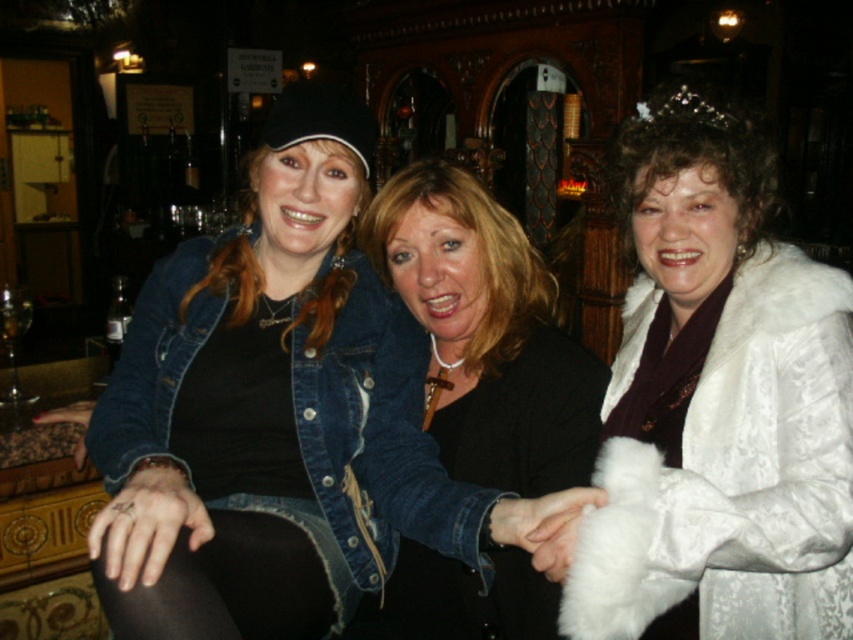
Question: Is denim jacket at center positioned in front of black matte jacket at center?

Choices:
 (A) no
 (B) yes

Answer: (B)

Question: Among these objects, which one is nearest to the camera?

Choices:
 (A) denim jacket at center
 (B) black tights at lower left
 (C) black matte jacket at center
 (D) white fur coat at center

Answer: (B)

Question: Which point is closer to the camera taking this photo?

Choices:
 (A) coord(132,561)
 (B) coord(825,602)

Answer: (A)

Question: Can you confirm if white fur coat at center is thinner than black tights at lower left?

Choices:
 (A) no
 (B) yes

Answer: (A)

Question: Is white fur coat at center wider than black matte jacket at center?

Choices:
 (A) no
 (B) yes

Answer: (B)

Question: Among these points, which one is nearest to the camera?

Choices:
 (A) (265, 605)
 (B) (379, 362)
 (C) (415, 202)
 (D) (815, 387)

Answer: (A)